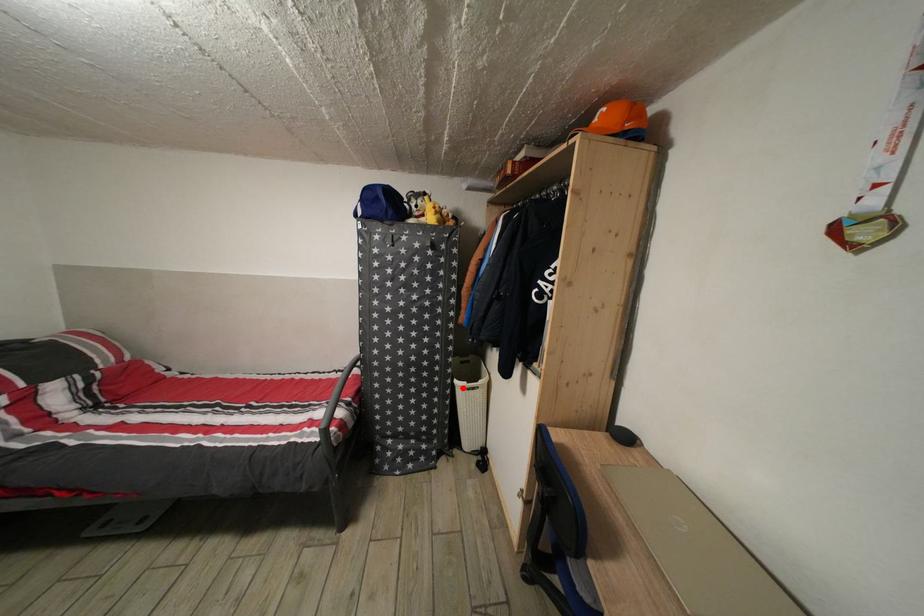
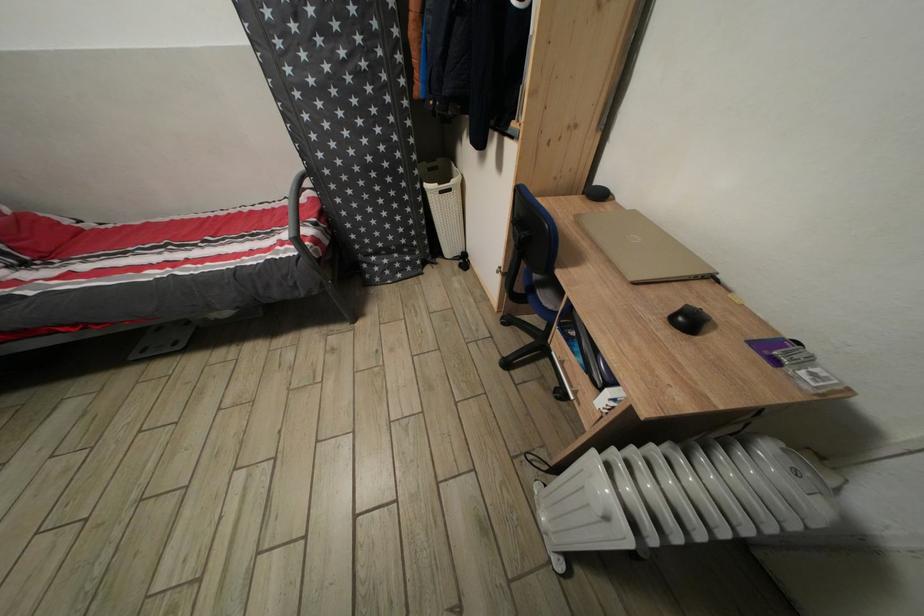
Question: A red point is marked in image1. In image2, is the corresponding 3D point closer to the camera or farther? Reply with the corresponding letter.

Choices:
 (A) The corresponding 3D point is closer.
 (B) The corresponding 3D point is farther.

Answer: (A)